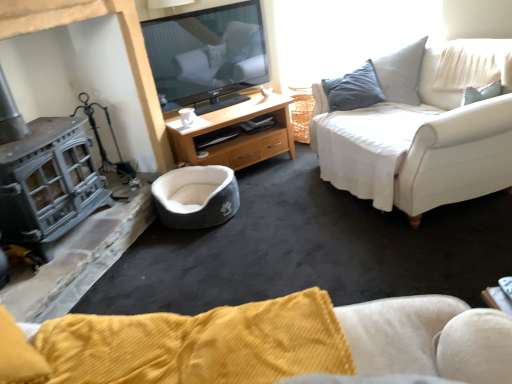
Find the location of a particular element. The height and width of the screenshot is (384, 512). vacant area that is in front of wooden tv stand at center is located at coordinates (272, 202).